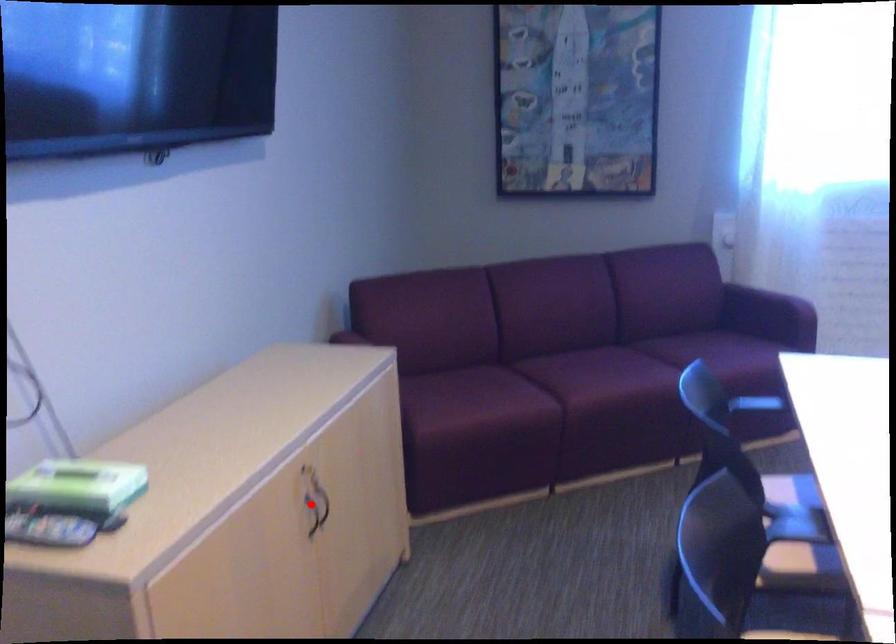
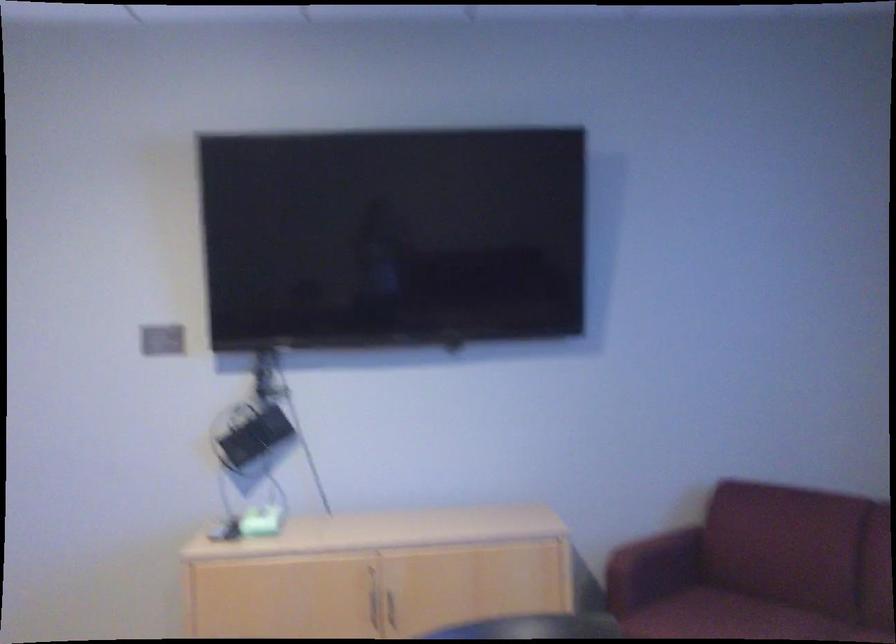
Question: I am providing you with two images of the same scene from different viewpoints. Given a red point in image1, look at the same physical point in image2. Is it:

Choices:
 (A) Closer to the viewpoint
 (B) Farther from the viewpoint

Answer: (B)